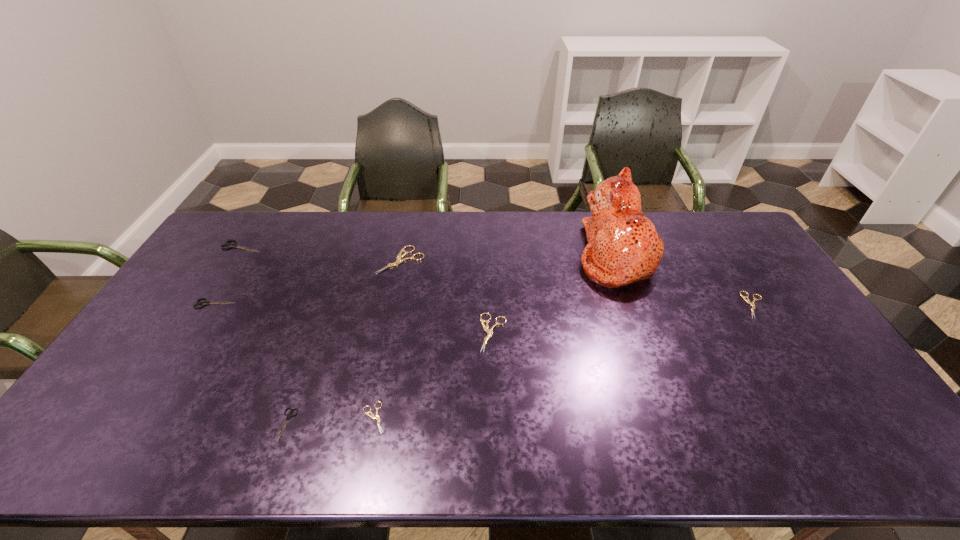
Locate an element on the screen. This screenshot has height=540, width=960. the sixth object from right to left is located at coordinates (288, 416).

The width and height of the screenshot is (960, 540). I want to click on the smallest beige shears, so click(x=372, y=416).

Locate an element on the screen. the shortest object is located at coordinates (372, 416).

Locate an element on the screen. The image size is (960, 540). blank space located 0.090m on the face of the cat is located at coordinates (552, 254).

The image size is (960, 540). Find the location of `blank space located on the face of the cat`. blank space located on the face of the cat is located at coordinates (540, 254).

The image size is (960, 540). I want to click on free spot located 0.140m on the face of the cat, so click(x=538, y=254).

This screenshot has height=540, width=960. What are the coordinates of `vacant area situated on the right of the farthest black shears` in the screenshot? It's located at (358, 246).

The image size is (960, 540). In order to click on free location located 0.360m on the right of the biggest beige shears in this screenshot , I will do `click(528, 260)`.

Find the location of a particular element. The image size is (960, 540). vacant space situated 0.060m on the front of the second smallest black shears is located at coordinates (203, 323).

Locate an element on the screen. The image size is (960, 540). vacant region located on the left of the sixth object from left to right is located at coordinates (367, 333).